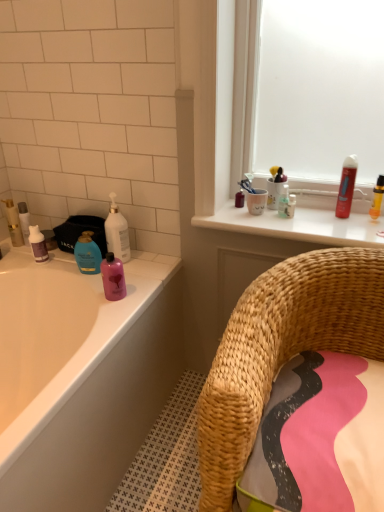
Question: From a real-world perspective, is purple matte bottle at left, arranged as the second mouthwash when ordered from the bottom, positioned under pink glossy bottle at upper left, the 3th mouthwash in the top-to-bottom sequence, based on gravity?

Choices:
 (A) yes
 (B) no

Answer: (B)

Question: Does purple matte bottle at left, arranged as the second mouthwash when ordered from the bottom, have a smaller size compared to pink glossy bottle at upper left, which appears as the second mouthwash when viewed from the right?

Choices:
 (A) yes
 (B) no

Answer: (A)

Question: Is pink glossy bottle at upper left, the 3th mouthwash in the top-to-bottom sequence, inside purple matte bottle at left, the third mouthwash viewed from the right?

Choices:
 (A) yes
 (B) no

Answer: (B)

Question: Considering the relative sizes of purple matte bottle at left, which ranks as the 1th mouthwash in left-to-right order, and pink glossy bottle at upper left, which appears as the second mouthwash when viewed from the left, in the image provided, is purple matte bottle at left, which ranks as the 1th mouthwash in left-to-right order, bigger than pink glossy bottle at upper left, which appears as the second mouthwash when viewed from the left,?

Choices:
 (A) no
 (B) yes

Answer: (A)

Question: From the image's perspective, is purple matte bottle at left, which ranks as the 1th mouthwash in left-to-right order, under pink glossy bottle at upper left, the first mouthwash from the bottom?

Choices:
 (A) no
 (B) yes

Answer: (A)

Question: Is purple matte bottle at left, the second mouthwash in the top-to-bottom sequence, to the left or to the right of matte white tube at left, marked as the 5th toiletry in a right-to-left arrangement, in the image?

Choices:
 (A) left
 (B) right

Answer: (B)

Question: From the image's perspective, relative to matte white tube at left, which is the 2th toiletry from left to right, is purple matte bottle at left, the third mouthwash viewed from the right, above or below?

Choices:
 (A) above
 (B) below

Answer: (B)

Question: Considering the positions of point (36, 243) and point (26, 224), is point (36, 243) closer or farther from the camera than point (26, 224)?

Choices:
 (A) farther
 (B) closer

Answer: (B)

Question: Considering the positions of purple matte bottle at left, arranged as the second mouthwash when ordered from the bottom, and matte white tube at left, which is the 2th toiletry from left to right, in the image, is purple matte bottle at left, arranged as the second mouthwash when ordered from the bottom, wider or thinner than matte white tube at left, which is the 2th toiletry from left to right,?

Choices:
 (A) thin
 (B) wide

Answer: (B)

Question: Considering the positions of woven straw chair at lower right and blue glossy lotion at left, placed as the 3th toiletry when sorted from left to right, in the image, is woven straw chair at lower right bigger or smaller than blue glossy lotion at left, placed as the 3th toiletry when sorted from left to right,?

Choices:
 (A) small
 (B) big

Answer: (B)

Question: Would you say woven straw chair at lower right is to the left or to the right of blue glossy lotion at left, which is counted as the 4th toiletry, starting from the right, in the picture?

Choices:
 (A) left
 (B) right

Answer: (B)

Question: Would you say woven straw chair at lower right is inside or outside blue glossy lotion at left, placed as the 3th toiletry when sorted from left to right?

Choices:
 (A) inside
 (B) outside

Answer: (B)

Question: Is woven straw chair at lower right taller or shorter than blue glossy lotion at left, placed as the 3th toiletry when sorted from left to right?

Choices:
 (A) short
 (B) tall

Answer: (B)

Question: Considering the positions of woven straw chair at lower right and white glossy bottle at upper left in the image, is woven straw chair at lower right bigger or smaller than white glossy bottle at upper left?

Choices:
 (A) big
 (B) small

Answer: (A)

Question: Do you think woven straw chair at lower right is within white glossy bottle at upper left, or outside of it?

Choices:
 (A) outside
 (B) inside

Answer: (A)